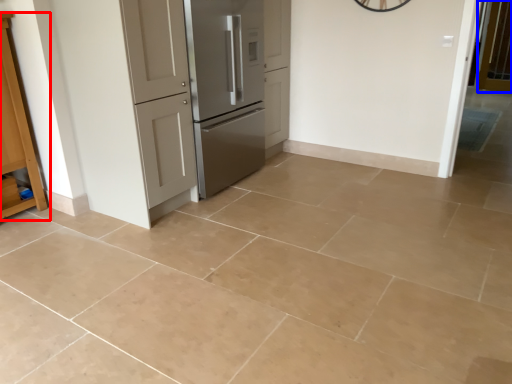
Question: Which of the following is the farthest to the observer, cabinetry (highlighted by a red box) or screen door (highlighted by a blue box)?

Choices:
 (A) cabinetry
 (B) screen door

Answer: (B)